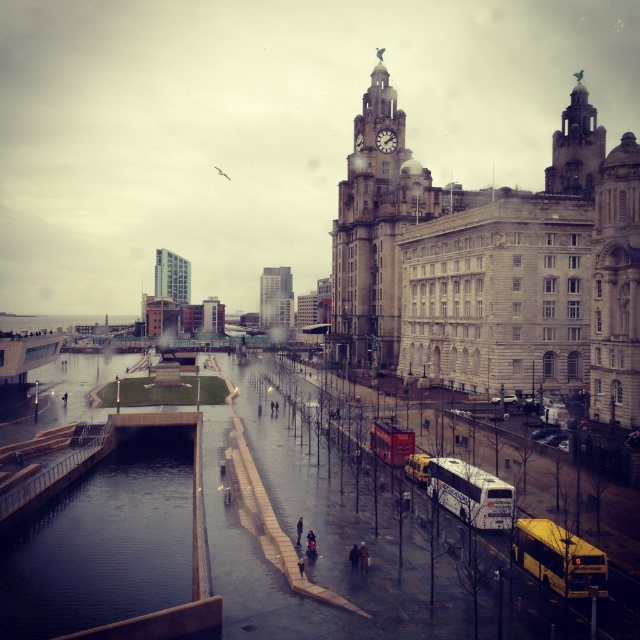
Does point (118, 605) come farther from viewer compared to point (522, 524)?

Yes, point (118, 605) is farther from viewer.

Between dark glassy water at lower left and yellow metallic bus at lower right, which one appears on the left side from the viewer's perspective?

Positioned to the left is dark glassy water at lower left.

Who is more forward, (157, 544) or (540, 548)?

Point (540, 548)

Identify the location of dark glassy water at lower left. The height and width of the screenshot is (640, 640). (104, 544).

Can you confirm if dark glassy water at lower left is positioned above white matte/decorative bus at center?

No.

Which is above, dark glassy water at lower left or white matte/decorative bus at center?

Positioned higher is white matte/decorative bus at center.

Between point (140, 518) and point (513, 493), which one is positioned behind?

Point (140, 518)

Image resolution: width=640 pixels, height=640 pixels. In order to click on dark glassy water at lower left in this screenshot , I will do `click(104, 544)`.

Which is above, dark glassy water at lower left or golden stone clock tower at upper right?

golden stone clock tower at upper right

Does dark glassy water at lower left appear over golden stone clock tower at upper right?

Actually, dark glassy water at lower left is below golden stone clock tower at upper right.

Which is behind, point (164, 556) or point (577, 100)?

Point (577, 100)

Identify the location of dark glassy water at lower left. (104, 544).